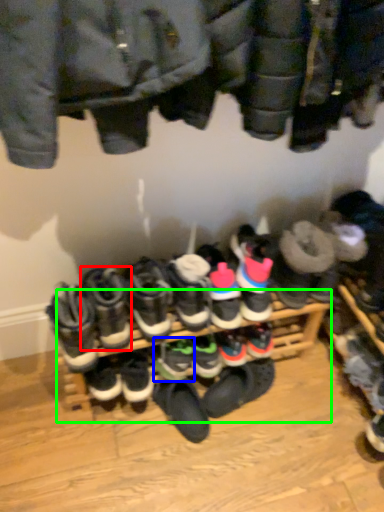
Question: Based on their relative distances, which object is nearer to footwear (highlighted by a red box)? Choose from footwear (highlighted by a blue box) and shelf (highlighted by a green box).

Choices:
 (A) footwear
 (B) shelf

Answer: (A)